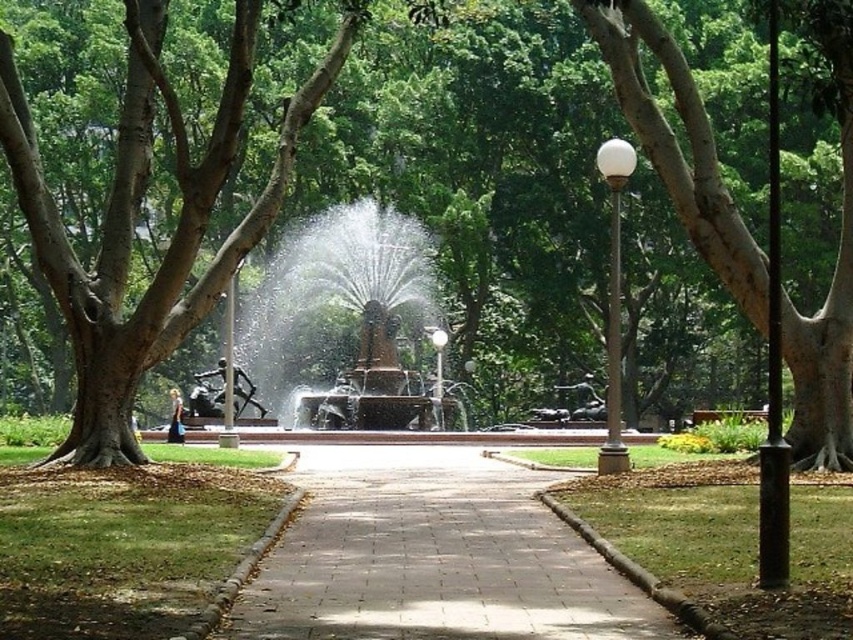
Between brown textured tree at center and wooden bench at center, which one is positioned lower?

wooden bench at center is below.

Describe the element at coordinates (137, 212) in the screenshot. Image resolution: width=853 pixels, height=640 pixels. I see `brown textured tree at center` at that location.

Which is behind, point (257, 12) or point (706, 412)?

The point (706, 412) is behind.

Locate an element on the screen. brown textured tree at center is located at coordinates (137, 212).

Can you confirm if smooth brown tree trunk at left is thinner than wooden bench at center?

No, smooth brown tree trunk at left is not thinner than wooden bench at center.

Can you confirm if smooth brown tree trunk at left is positioned to the right of wooden bench at center?

No, smooth brown tree trunk at left is not to the right of wooden bench at center.

Which is in front, point (26, 141) or point (759, 412)?

Point (26, 141) is more forward.

The height and width of the screenshot is (640, 853). What are the coordinates of `smooth brown tree trunk at left` in the screenshot? It's located at (136, 214).

Between paved stone pathway at center and white glossy lamp post at center right, which one is positioned higher?

white glossy lamp post at center right is higher up.

Can you confirm if paved stone pathway at center is smaller than white glossy lamp post at center right?

Correct, paved stone pathway at center occupies less space than white glossy lamp post at center right.

Identify the location of paved stone pathway at center. (433, 557).